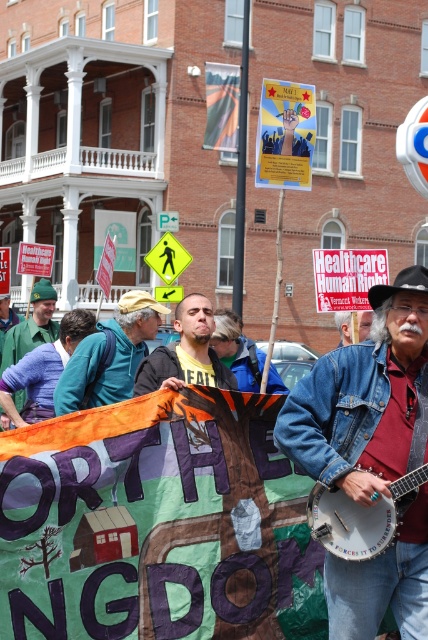
Question: Can you confirm if teal fleece jacket at center is wider than wooden banjo at center?

Choices:
 (A) no
 (B) yes

Answer: (B)

Question: Which point is closer to the camera?

Choices:
 (A) (220, 380)
 (B) (372, 509)

Answer: (B)

Question: Considering the real-world distances, which object is closest to the teal fleece jacket at center?

Choices:
 (A) denim jacket at lower right
 (B) denim jacket at center
 (C) wooden banjo at center

Answer: (B)

Question: Among these points, which one is farthest from the camera?

Choices:
 (A) (89, 358)
 (B) (118, 538)
 (C) (406, 280)

Answer: (A)

Question: Is green fabric banner at center closer to the viewer compared to teal fleece jacket at center?

Choices:
 (A) no
 (B) yes

Answer: (B)

Question: Is wooden banjo at center positioned at the back of denim jacket at lower right?

Choices:
 (A) yes
 (B) no

Answer: (B)